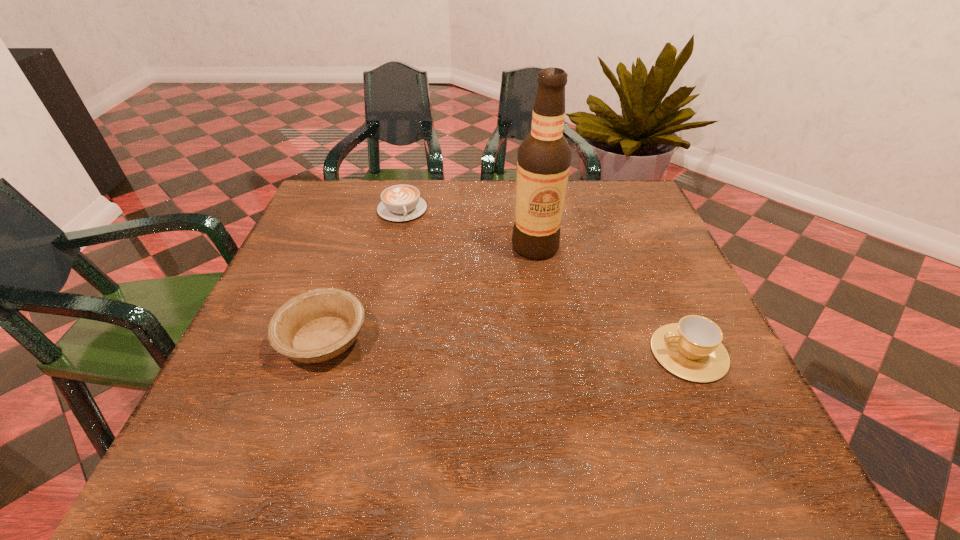
I want to click on bowl, so click(318, 325).

The height and width of the screenshot is (540, 960). What are the coordinates of `cup` in the screenshot? It's located at (691, 349).

Find the location of a particular element. This screenshot has height=540, width=960. the shortest object is located at coordinates (399, 202).

The height and width of the screenshot is (540, 960). In order to click on cappuccino in this screenshot , I will do `click(399, 202)`.

The width and height of the screenshot is (960, 540). Find the location of `the third object from left to right`. the third object from left to right is located at coordinates pos(543,162).

Image resolution: width=960 pixels, height=540 pixels. I want to click on alcohol, so click(543, 162).

Locate an element on the screen. vacant area situated 0.260m on the right of the bowl is located at coordinates (502, 340).

Identify the location of vacant region located with the handle on the side of the cup. (484, 353).

You are a GUI agent. You are given a task and a screenshot of the screen. Output one action in this format:
    pyautogui.click(x=<x>, y=<y>)
    Task: Click on the vacant space situated 0.140m with the handle on the side of the cup
    Image resolution: width=960 pixels, height=540 pixels.
    Given the screenshot: What is the action you would take?
    pyautogui.click(x=578, y=353)

At what (x,y) coordinates should I click in order to perform the action: click on free region located 0.250m with the handle on the side of the cup. Please return your answer as a coordinate pair (x, y). This screenshot has width=960, height=540. Looking at the image, I should click on (520, 353).